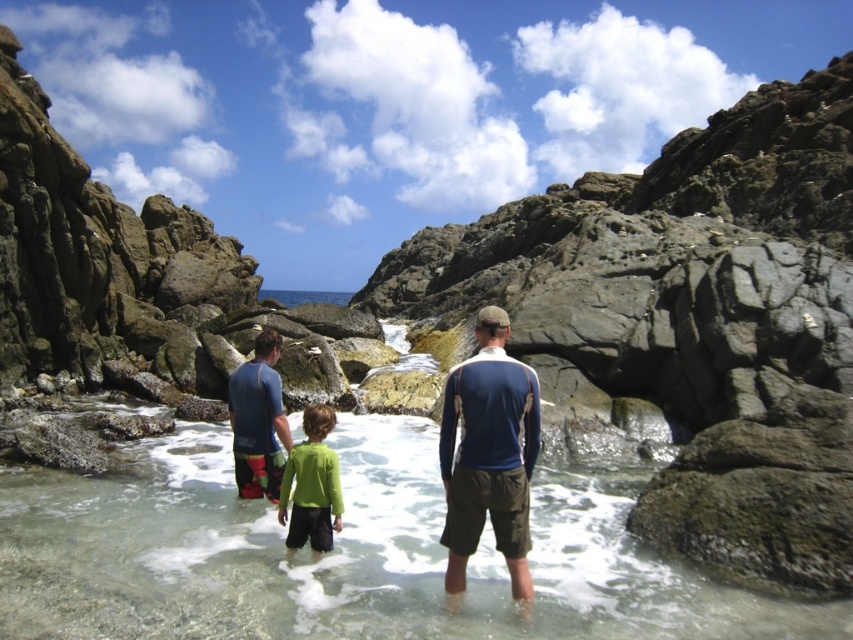
Question: Which object is positioned farthest from the blue/white long-sleeved shirt at center?

Choices:
 (A) blue wetsuit at center
 (B) green matte shirt at center
 (C) clear water at center

Answer: (A)

Question: Where is blue wetsuit at center located in relation to green matte shirt at center in the image?

Choices:
 (A) below
 (B) above

Answer: (B)

Question: Does blue wetsuit at center appear over green matte shirt at center?

Choices:
 (A) no
 (B) yes

Answer: (B)

Question: Does blue/white long-sleeved shirt at center have a larger size compared to blue wetsuit at center?

Choices:
 (A) yes
 (B) no

Answer: (B)

Question: Estimate the real-world distances between objects in this image. Which object is farther from the blue wetsuit at center?

Choices:
 (A) clear water at center
 (B) blue/white long-sleeved shirt at center
 (C) green matte shirt at center

Answer: (B)

Question: Which of the following is the closest to the observer?

Choices:
 (A) (242, 387)
 (B) (1, 465)

Answer: (A)